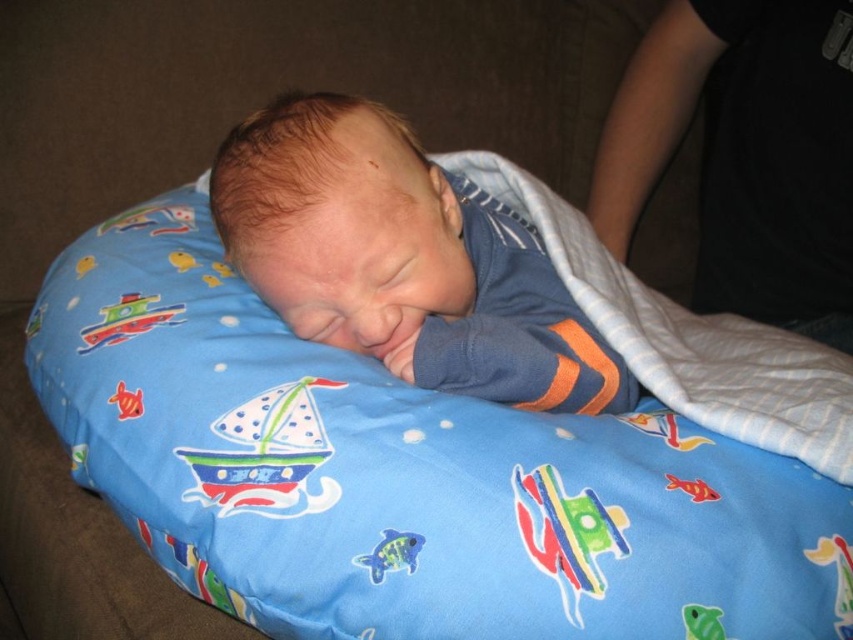
You are a caregiver trying to ensure the baby has enough space to move comfortably. Based on the image, does the blue soft fabric baby at center have enough space compared to the black cotton sleeve at upper right?

The blue soft fabric baby at center occupies less space than the black cotton sleeve at upper right, so the baby has enough space to move comfortably.

You are a photographer trying to capture the baby in the center. Where exactly should you focus your camera lens to ensure the blue soft fabric baby at center is in sharp focus?

You should focus your camera lens at point (403, 259) to ensure the blue soft fabric baby at center is in sharp focus.